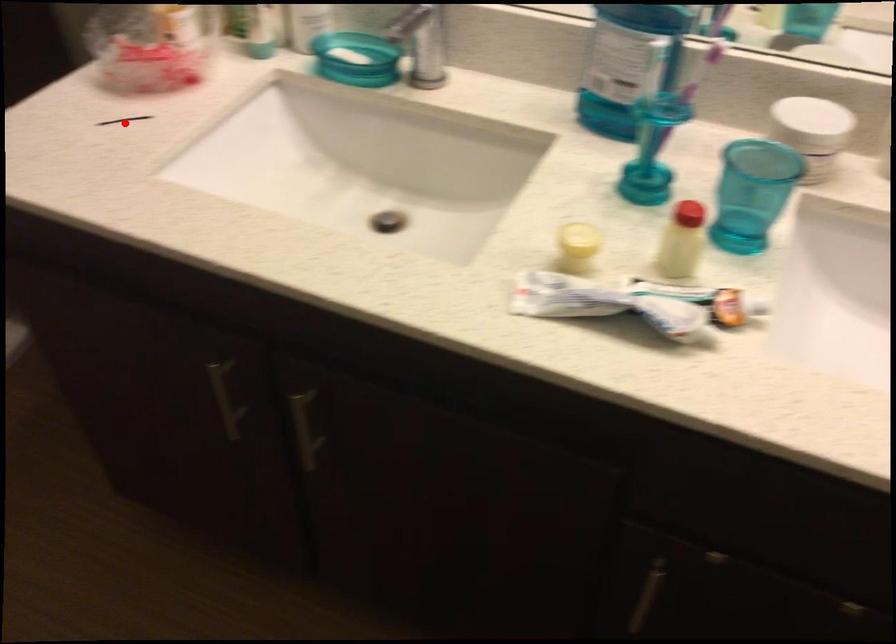
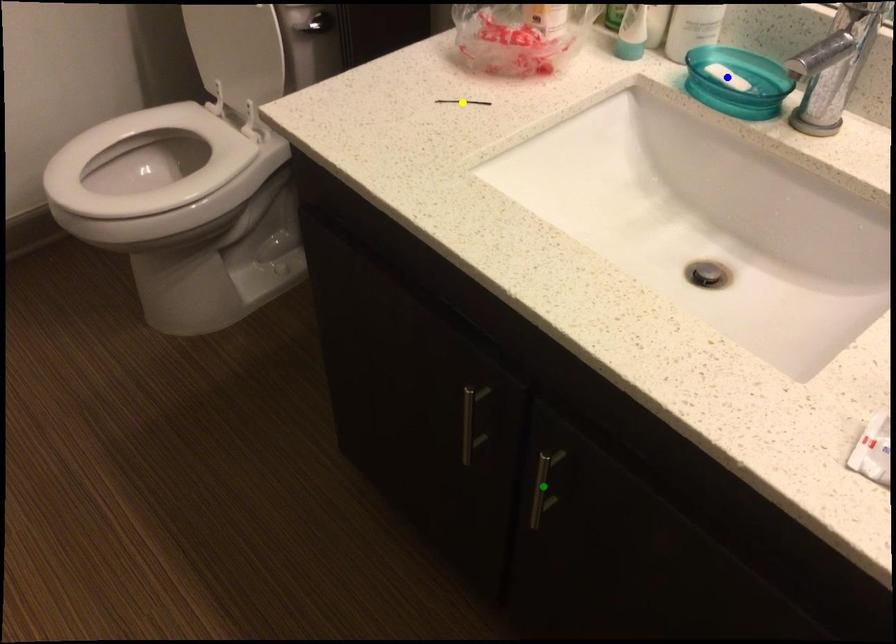
Question: I am providing you with two images of the same scene from different viewpoints. A red point is marked on the first image. You are given multiple points on the second image. Which mark in image 2 goes with the point in image 1?

Choices:
 (A) green point
 (B) blue point
 (C) yellow point

Answer: (C)